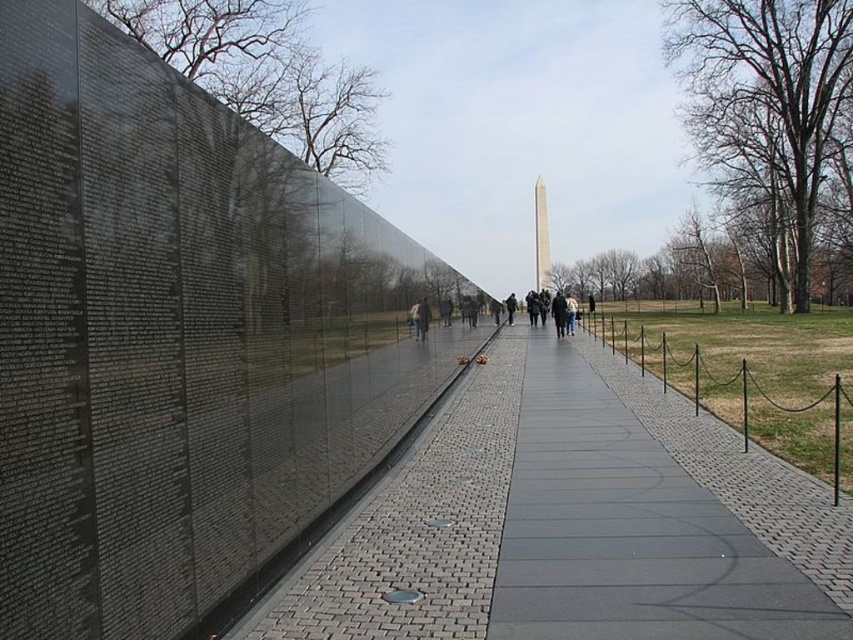
How far apart are gray concrete sidewalk at center and polished marble obelisk at center?

50.22 meters

Does gray concrete sidewalk at center come in front of polished marble obelisk at center?

That is True.

Locate an element on the screen. gray concrete sidewalk at center is located at coordinates (573, 522).